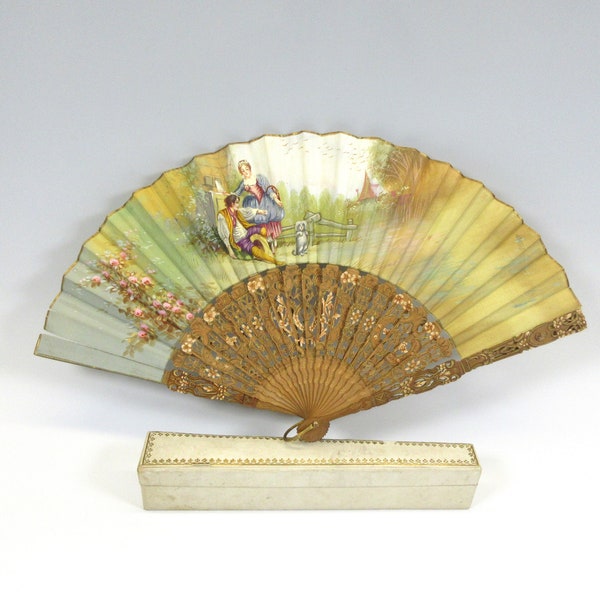
What are the coordinates of `pink fllowers artwork` in the screenshot? It's located at (118, 255), (115, 263), (94, 280), (138, 281), (123, 287), (180, 305), (160, 302), (160, 325), (137, 310), (144, 337).